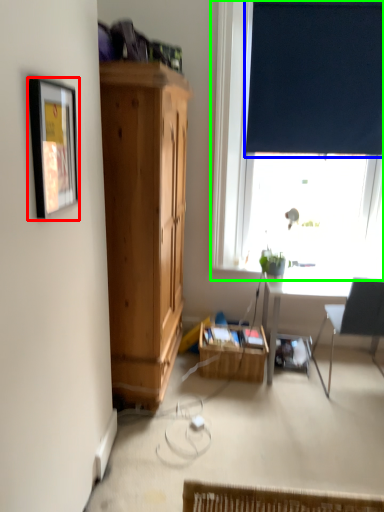
Question: Which object is the closest to the picture frame (highlighted by a red box)? Choose among these: curtain (highlighted by a blue box) or window (highlighted by a green box).

Choices:
 (A) curtain
 (B) window

Answer: (B)